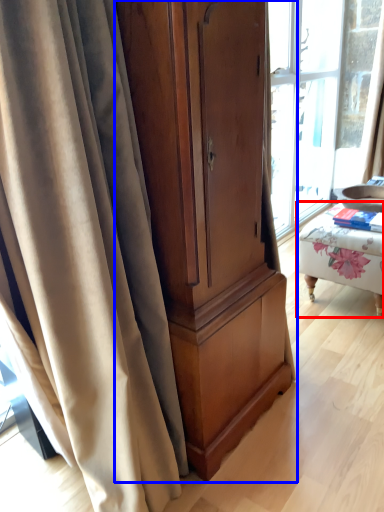
Question: Among these objects, which one is farthest to the camera, furniture (highlighted by a red box) or cabinetry (highlighted by a blue box)?

Choices:
 (A) furniture
 (B) cabinetry

Answer: (A)